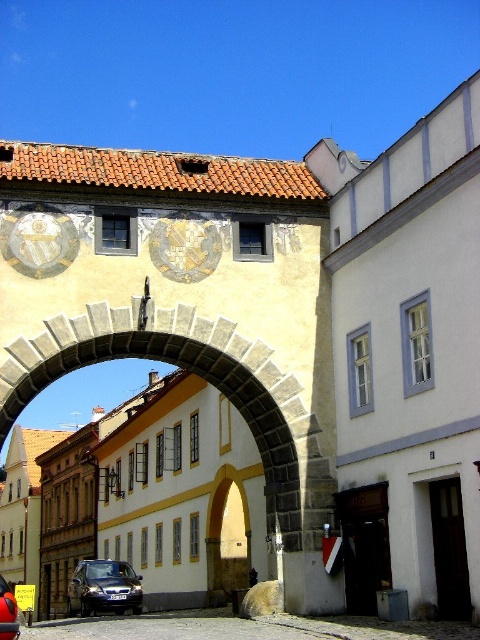
You are standing in the historic town square and want to take a photo of the stone archway at center. The photographer told you to stand at point (x=186, y=368). According to the scene description, where exactly is this point located?

The point (x=186, y=368) is located on the stone archway at center.

You are a tourist standing in front of the historic town scene. You notice a matte stone clock at upper center and a dark gray metallic car at lower left. Which object is wider?

The dark gray metallic car at lower left is wider than the matte stone clock at upper center.

You are a tourist standing in the historic town and see the stone archway at center and the dark gray metallic car at lower left. Which object is closer to you?

The stone archway at center is closer to you because it is in front of the dark gray metallic car at lower left.